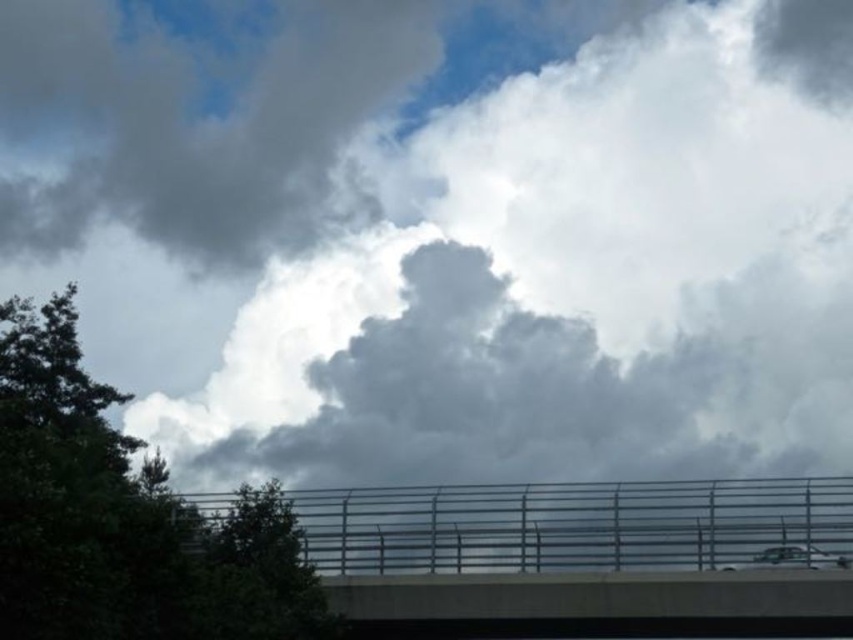
You are standing on the sidewalk and looking at the concrete overpass at center and the green leafy tree at upper left. Which object is positioned to the right of the other?

The concrete overpass at center is positioned to the right of the green leafy tree at upper left.

You are a bird flying over the scene. You see the concrete overpass at center and the green leafy tree at upper left. Which object is positioned higher in the sky?

The green leafy tree at upper left is positioned higher in the sky than the concrete overpass at center.

You are standing at the center of the image and want to move towards the concrete overpass at center. Which direction should you move to reach it?

The concrete overpass at center is already at the center of the image, so you are already at its location.